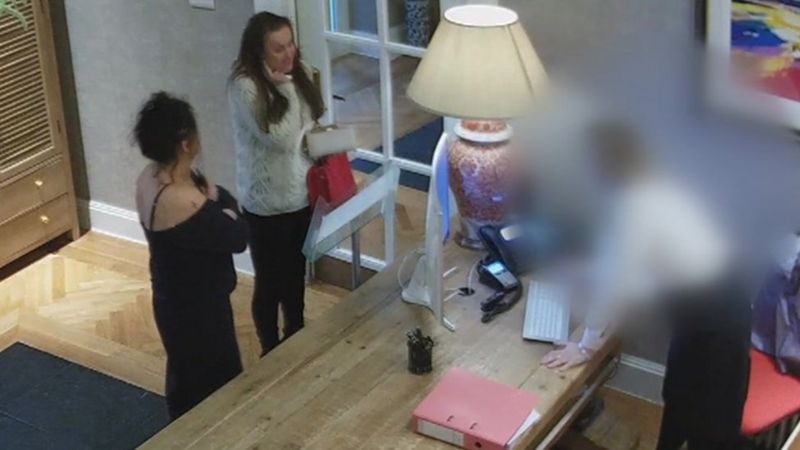
This screenshot has height=450, width=800. In order to click on monitor in this screenshot , I will do 434,243.